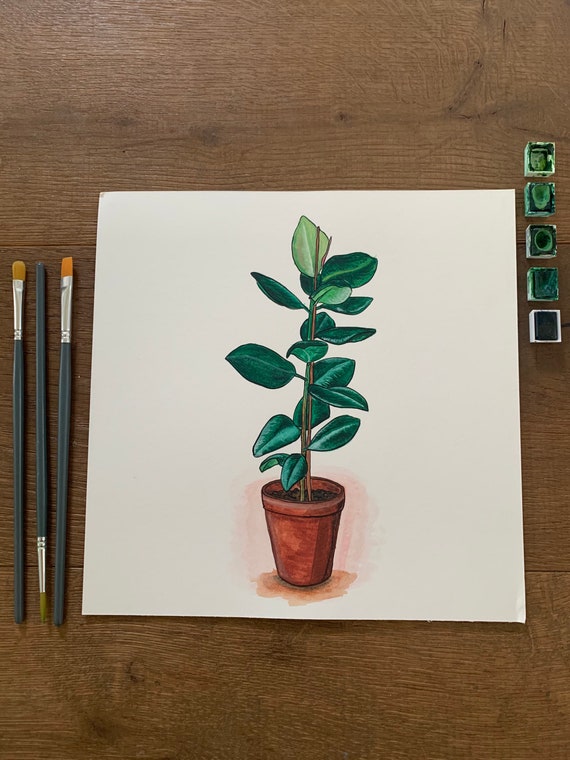
The image size is (570, 760). Identify the location of pot. (297, 537).